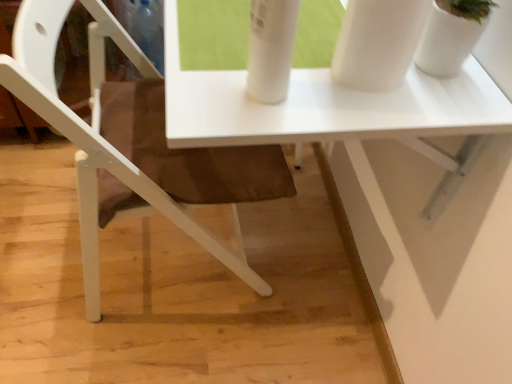
Question: Is white glossy table at center shorter than white glossy vase at upper right?

Choices:
 (A) yes
 (B) no

Answer: (B)

Question: From a real-world perspective, is white glossy table at center on top of white glossy vase at upper right?

Choices:
 (A) yes
 (B) no

Answer: (B)

Question: Is white glossy table at center far from white glossy vase at upper right?

Choices:
 (A) no
 (B) yes

Answer: (A)

Question: Is the position of white glossy table at center less distant than that of white glossy vase at upper right?

Choices:
 (A) no
 (B) yes

Answer: (A)

Question: Is white glossy table at center aimed at white glossy vase at upper right?

Choices:
 (A) no
 (B) yes

Answer: (A)

Question: In the image, is white glossy vase at upper right positioned in front of or behind white matte chair at lower left?

Choices:
 (A) front
 (B) behind

Answer: (A)

Question: From the image's perspective, is white glossy vase at upper right above or below white matte chair at lower left?

Choices:
 (A) above
 (B) below

Answer: (A)

Question: Is white glossy vase at upper right taller or shorter than white matte chair at lower left?

Choices:
 (A) short
 (B) tall

Answer: (A)

Question: Is white glossy vase at upper right situated inside white matte chair at lower left or outside?

Choices:
 (A) inside
 (B) outside

Answer: (B)

Question: In the image, is white matte chair at lower left on the left side or the right side of white glossy vase at upper right?

Choices:
 (A) left
 (B) right

Answer: (A)

Question: From their relative heights in the image, would you say white matte chair at lower left is taller or shorter than white glossy vase at upper right?

Choices:
 (A) short
 (B) tall

Answer: (B)

Question: Considering the positions of point (132, 177) and point (444, 0), is point (132, 177) closer or farther from the camera than point (444, 0)?

Choices:
 (A) farther
 (B) closer

Answer: (A)

Question: From the image's perspective, relative to white glossy vase at upper right, is white matte chair at lower left above or below?

Choices:
 (A) below
 (B) above

Answer: (A)

Question: Is white glossy table at center bigger or smaller than white glossy vase at upper right?

Choices:
 (A) big
 (B) small

Answer: (A)

Question: From a real-world perspective, is white glossy table at center above or below white glossy vase at upper right?

Choices:
 (A) above
 (B) below

Answer: (B)